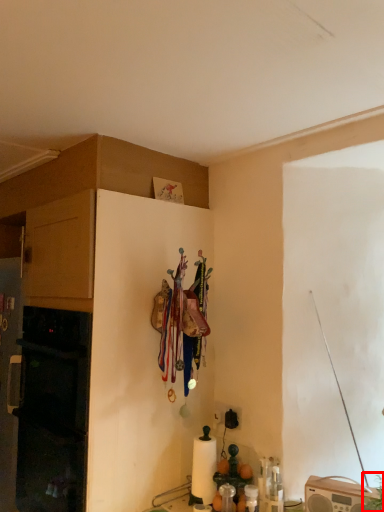
Question: Observing the image, what is the correct spatial positioning of plant (annotated by the red box) in reference to cabinetry?

Choices:
 (A) left
 (B) right

Answer: (B)